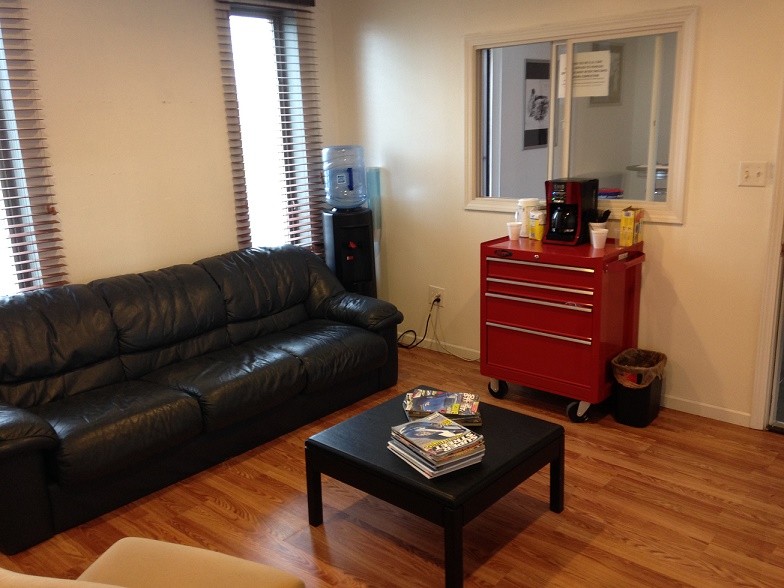
At what (x,y) coordinates should I click in order to perform the action: click on table. Please return your answer as a coordinate pair (x, y). Looking at the image, I should click on (357, 442).